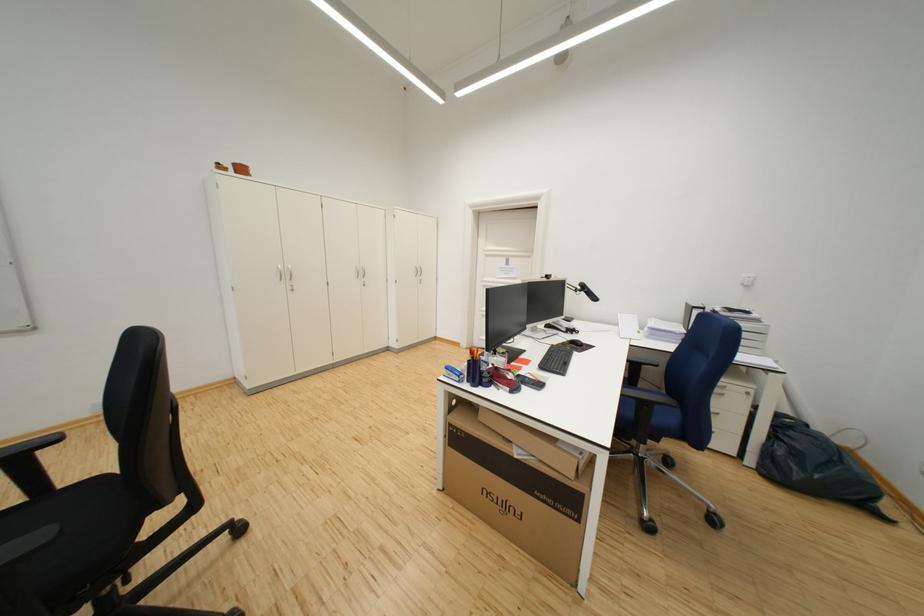
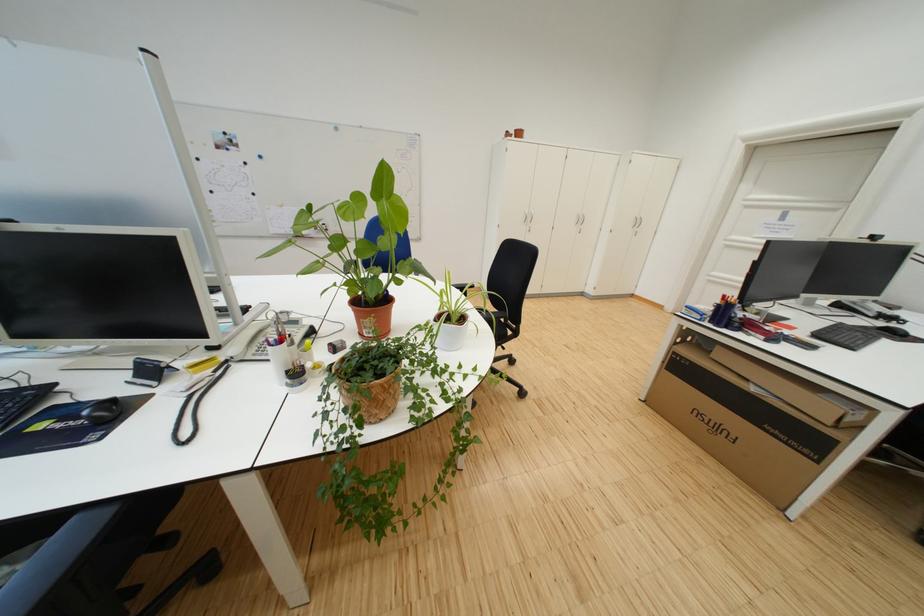
Where in the second image is the point corresponding to point (497, 376) from the first image?

(748, 322)